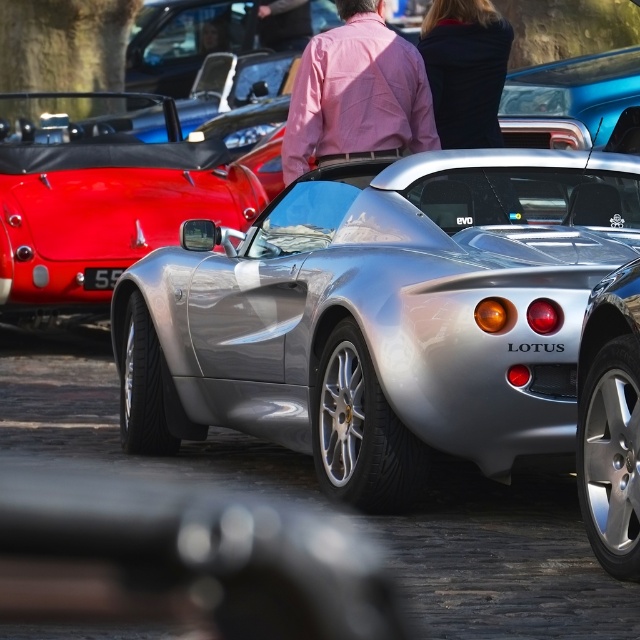
Question: Which object is closer to the camera taking this photo?

Choices:
 (A) shiny blue car at upper right
 (B) black matte jacket at upper center
 (C) metallic silver sports car at center

Answer: (B)

Question: Which of the following is the closest to the observer?

Choices:
 (A) metallic silver sports car at center
 (B) black matte jacket at upper center
 (C) shiny blue car at upper right

Answer: (B)

Question: Can you confirm if black matte jacket at upper center is wider than shiny blue car at upper right?

Choices:
 (A) yes
 (B) no

Answer: (B)

Question: Which point is closer to the camera?

Choices:
 (A) (538, 90)
 (B) (460, 36)
 (C) (324, 148)
 (D) (189, 154)

Answer: (C)

Question: Observing the image, what is the correct spatial positioning of black matte jacket at upper center in reference to shiny blue car at upper right?

Choices:
 (A) left
 (B) right

Answer: (A)

Question: Does black matte jacket at upper center appear under shiny blue car at upper right?

Choices:
 (A) yes
 (B) no

Answer: (A)